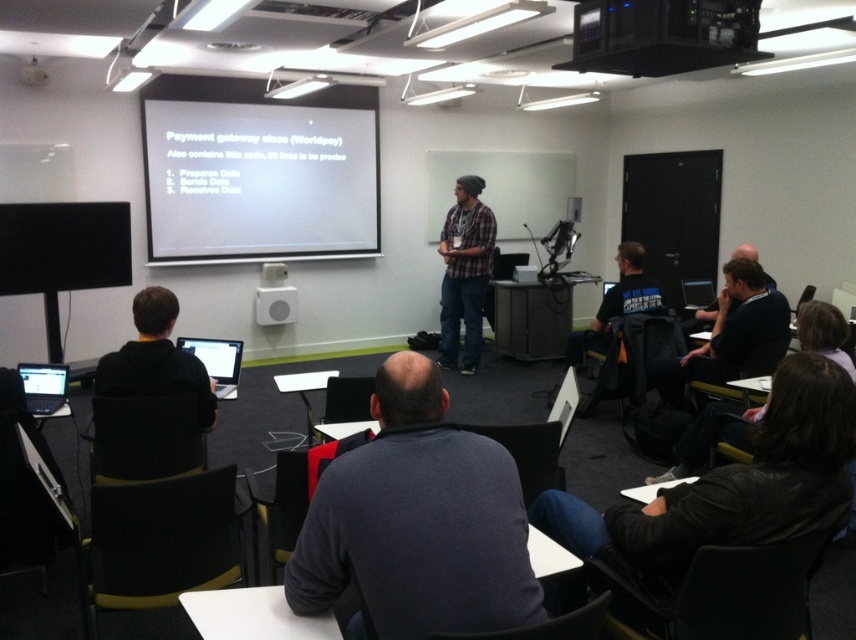
You are a student sitting at the back of the classroom and want to borrow a laptop charger from the matte black laptop at lower left. However, there is a black hoodie at left in the way. Can you reach the laptop charger without moving the hoodie?

The black hoodie at left is positioned on the right side of matte black laptop at lower left. Since the hoodie is to the right of the laptop, you can reach around the left side of the hoodie to access the laptop charger without moving it.

You are a student in the classroom and you need to reach the dark gray sweater at center to grab a pen. However, there is a matte black laptop at lower left in your way. Can you easily reach the sweater without moving the laptop?

The dark gray sweater at center is positioned under the matte black laptop at lower left, so you can easily reach it without moving the laptop since it is located beneath it.